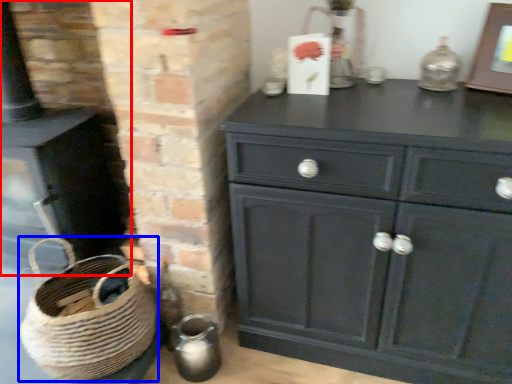
Question: Which of the following is the farthest to the observer, fireplace (highlighted by a red box) or basket (highlighted by a blue box)?

Choices:
 (A) fireplace
 (B) basket

Answer: (A)